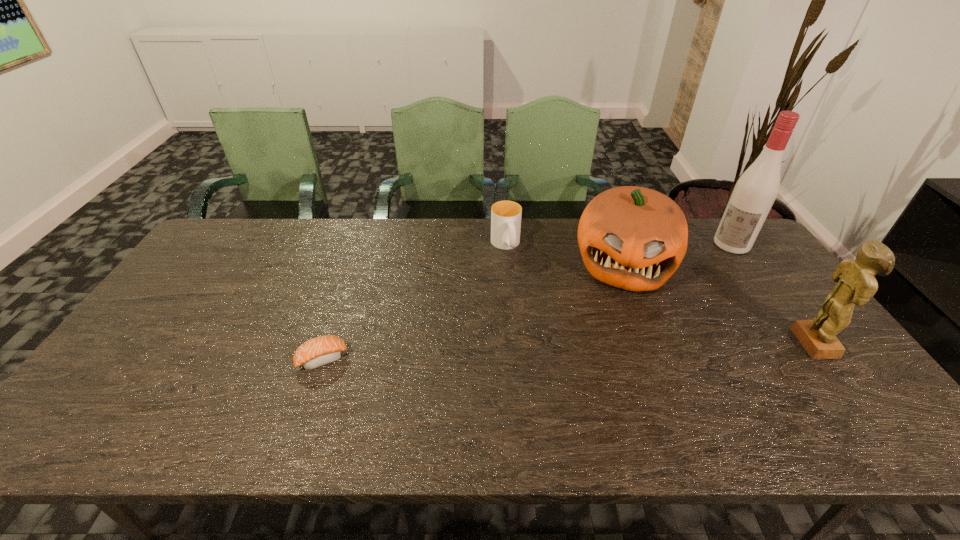
Locate an element on the screen. This screenshot has width=960, height=540. free spot between the figurine and the second object from left to right is located at coordinates (661, 294).

This screenshot has width=960, height=540. Find the location of `vacant space that is in between the figurine and the cup`. vacant space that is in between the figurine and the cup is located at coordinates (661, 294).

Image resolution: width=960 pixels, height=540 pixels. In order to click on vacant space in between the shortest object and the tallest object in this screenshot , I will do `click(527, 302)`.

Locate an element on the screen. This screenshot has height=540, width=960. free space between the pumpkin and the cup is located at coordinates (564, 254).

The width and height of the screenshot is (960, 540). Find the location of `free point between the shortest object and the second object from left to right`. free point between the shortest object and the second object from left to right is located at coordinates (x=414, y=302).

What are the coordinates of `free point between the third object from right to left and the figurine` in the screenshot? It's located at (720, 303).

You are a GUI agent. You are given a task and a screenshot of the screen. Output one action in this format:
    pyautogui.click(x=<x>, y=<y>)
    Task: Click on the closest object to the second tallest object
    
    Given the screenshot: What is the action you would take?
    pyautogui.click(x=634, y=238)

The image size is (960, 540). Identify the location of object that stands as the fourth closest to the pumpkin. (322, 350).

Locate an element on the screen. Image resolution: width=960 pixels, height=540 pixels. vacant position in the image that satisfies the following two spatial constraints: 1. on the back side of the tallest object; 2. on the left side of the second shortest object is located at coordinates (505, 244).